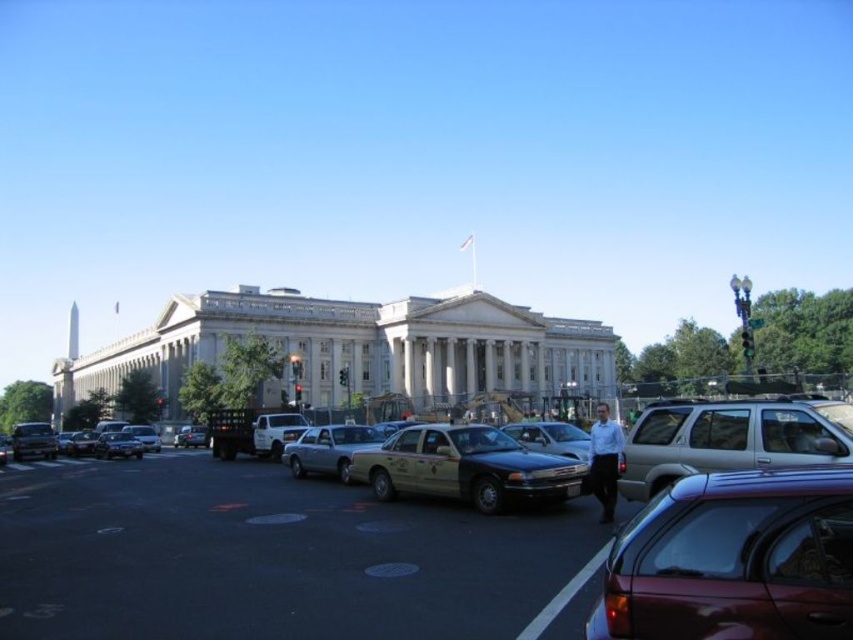
You are a delivery driver navigating through the busy street in front of the neoclassical building. You need to deliver a package to a location marked by point (827,417) and then to another location marked by point (345,464). Based on the image, which point should you visit first to follow the most efficient route?

You should visit point (827,417) first because it is in front of point (345,464), so it is closer to your current position on the street.

You are standing at the point closer to the large neoclassical building in the image. There are two points marked in the scene, one at point coordinates point (242, 493) and the other at point coordinates point (842, 499). Which point is located behind the other?

Point point (242, 493) is behind point point (842, 499).